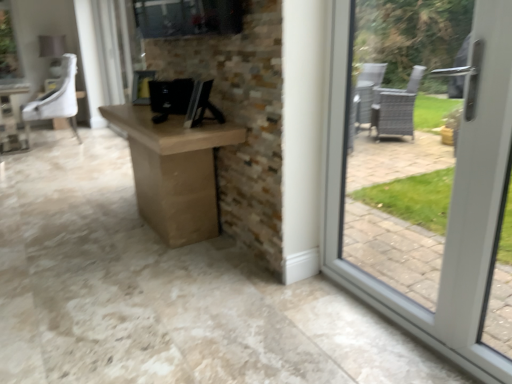
Question: Looking at their shapes, would you say brown cardboard box at center is wider or thinner than black glossy desktop computer at center?

Choices:
 (A) thin
 (B) wide

Answer: (B)

Question: Would you say brown cardboard box at center is to the left or to the right of black glossy desktop computer at center in the picture?

Choices:
 (A) right
 (B) left

Answer: (B)

Question: Which is farther from the white leather chair at upper left?

Choices:
 (A) black glossy desktop computer at center
 (B) brown cardboard box at center

Answer: (A)

Question: Considering the real-world distances, which object is farthest from the white leather chair at upper left?

Choices:
 (A) black glossy desktop computer at center
 (B) brown cardboard box at center

Answer: (A)